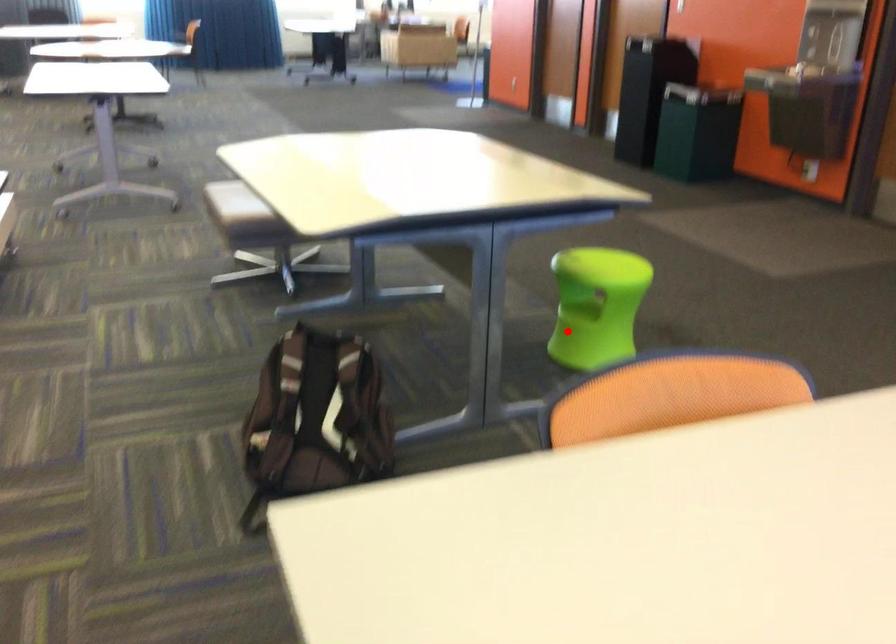
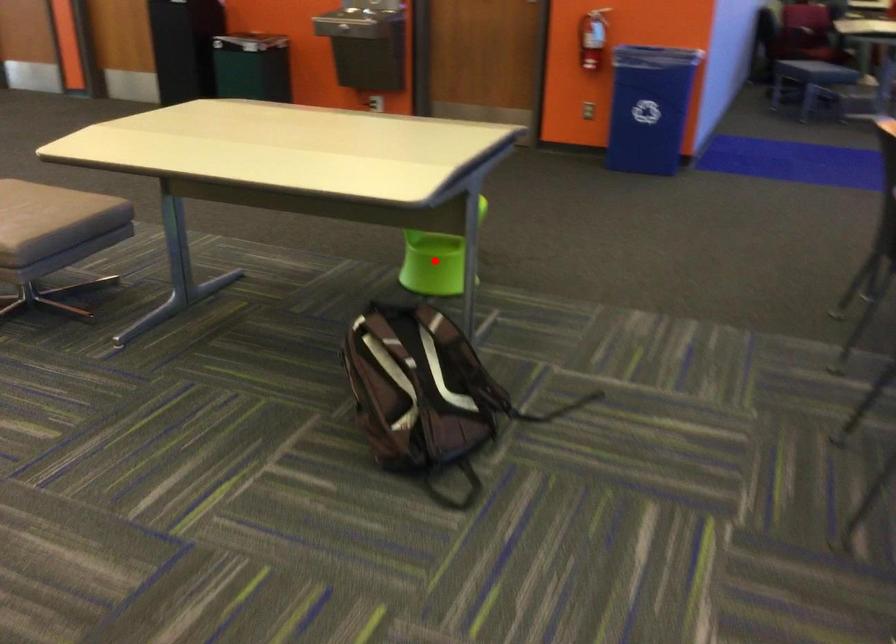
Based on the photo, I am providing you with two images of the same scene from different viewpoints. A red point is marked on the first image and another point is marked on the second image. Is the marked point in image1 the same physical position as the marked point in image2?

Yes